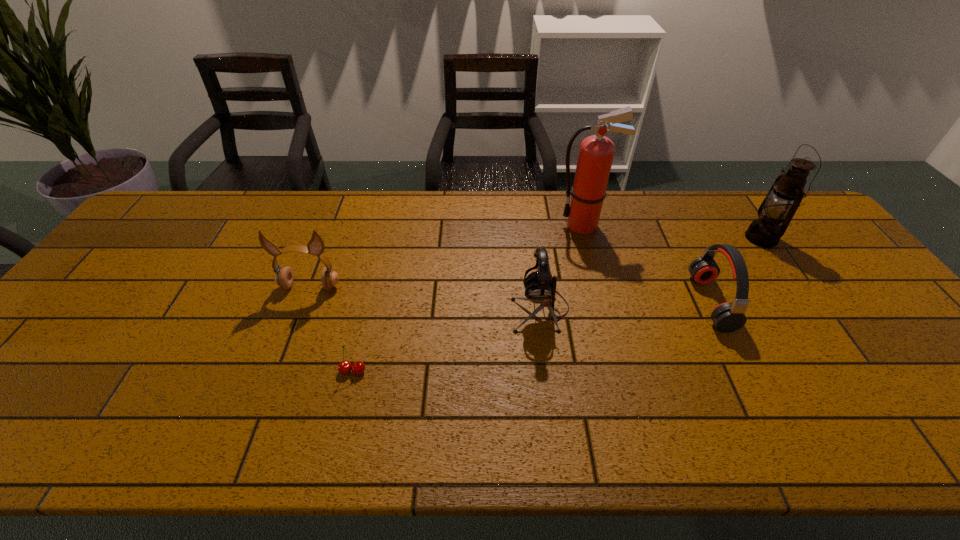
Find the location of a particular element. the second closest earphone to the fifth tallest object is located at coordinates (284, 277).

Select which earphone is the second closest to the fifth tallest object. Please provide its 2D coordinates. Your answer should be formatted as a tuple, i.e. [(x, y)], where the tuple contains the x and y coordinates of a point satisfying the conditions above.

[(284, 277)]

The width and height of the screenshot is (960, 540). In order to click on vacant region that satisfies the following two spatial constraints: 1. on the ear cups of the fifth object from left to right; 2. with the stems of the nearest object pointing upwards in this screenshot , I will do (x=744, y=371).

Find the location of `free spot that satisfies the following two spatial constraints: 1. on the front-facing side of the fourth object from right to left; 2. on the right side of the leftmost object`. free spot that satisfies the following two spatial constraints: 1. on the front-facing side of the fourth object from right to left; 2. on the right side of the leftmost object is located at coordinates (301, 310).

Where is `vacant area in the image that satisfies the following two spatial constraints: 1. on the hose direction of the fire extinguisher; 2. on the left side of the rightmost object`? vacant area in the image that satisfies the following two spatial constraints: 1. on the hose direction of the fire extinguisher; 2. on the left side of the rightmost object is located at coordinates (587, 238).

Identify the location of blank space that satisfies the following two spatial constraints: 1. on the back side of the rightmost object; 2. on the hose direction of the fire extinguisher. The width and height of the screenshot is (960, 540). (752, 225).

The width and height of the screenshot is (960, 540). I want to click on free space that satisfies the following two spatial constraints: 1. on the hose direction of the rightmost object; 2. on the right side of the tallest object, so click(x=587, y=238).

Image resolution: width=960 pixels, height=540 pixels. In order to click on vacant space that satisfies the following two spatial constraints: 1. on the hose direction of the oil lamp; 2. on the right side of the fourth object from left to right in this screenshot , I will do `click(587, 238)`.

Locate an element on the screen. The image size is (960, 540). vacant space that satisfies the following two spatial constraints: 1. on the ear cups of the second object from right to left; 2. with the stems of the nearest object pointing upwards is located at coordinates (744, 371).